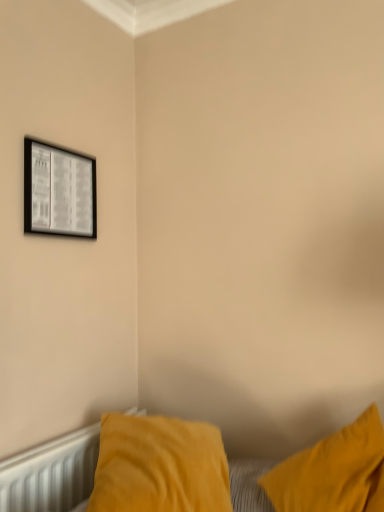
Question: From a real-world perspective, is velvet yellow pillow at lower right on top of black glossy picture frame at upper left?

Choices:
 (A) yes
 (B) no

Answer: (B)

Question: From the image's perspective, does velvet yellow pillow at lower right appear higher than black glossy picture frame at upper left?

Choices:
 (A) no
 (B) yes

Answer: (A)

Question: Considering the relative sizes of velvet yellow pillow at lower right and black glossy picture frame at upper left in the image provided, is velvet yellow pillow at lower right shorter than black glossy picture frame at upper left?

Choices:
 (A) no
 (B) yes

Answer: (B)

Question: Does velvet yellow pillow at lower right lie in front of black glossy picture frame at upper left?

Choices:
 (A) yes
 (B) no

Answer: (A)

Question: Is velvet yellow pillow at lower right smaller than black glossy picture frame at upper left?

Choices:
 (A) no
 (B) yes

Answer: (A)

Question: Considering the positions of point (79, 475) and point (13, 456), is point (79, 475) closer or farther from the camera than point (13, 456)?

Choices:
 (A) farther
 (B) closer

Answer: (A)

Question: From a real-world perspective, relative to velvet yellow pillow at lower right, is white textured radiator at lower left vertically above or below?

Choices:
 (A) above
 (B) below

Answer: (B)

Question: From their relative heights in the image, would you say white textured radiator at lower left is taller or shorter than velvet yellow pillow at lower right?

Choices:
 (A) tall
 (B) short

Answer: (A)

Question: In the image, is white textured radiator at lower left positioned in front of or behind velvet yellow pillow at lower right?

Choices:
 (A) behind
 (B) front

Answer: (A)

Question: Is white textured radiator at lower left inside or outside of black glossy picture frame at upper left?

Choices:
 (A) outside
 (B) inside

Answer: (A)

Question: From the image's perspective, relative to black glossy picture frame at upper left, is white textured radiator at lower left above or below?

Choices:
 (A) below
 (B) above

Answer: (A)

Question: Is white textured radiator at lower left bigger or smaller than black glossy picture frame at upper left?

Choices:
 (A) small
 (B) big

Answer: (B)

Question: Considering the positions of white textured radiator at lower left and black glossy picture frame at upper left in the image, is white textured radiator at lower left wider or thinner than black glossy picture frame at upper left?

Choices:
 (A) thin
 (B) wide

Answer: (B)

Question: Is point tap(256, 471) positioned closer to the camera than point tap(23, 188)?

Choices:
 (A) closer
 (B) farther

Answer: (A)

Question: From a real-world perspective, is velvet yellow pillow at lower right above or below black glossy picture frame at upper left?

Choices:
 (A) below
 (B) above

Answer: (A)